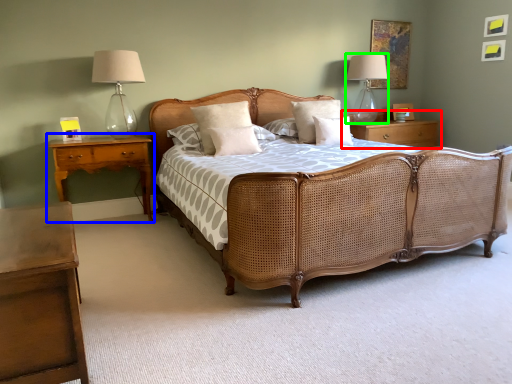
Question: Considering the real-world distances, which object is closest to nightstand (highlighted by a red box)? nightstand (highlighted by a blue box) or bedside lamp (highlighted by a green box).

Choices:
 (A) nightstand
 (B) bedside lamp

Answer: (B)